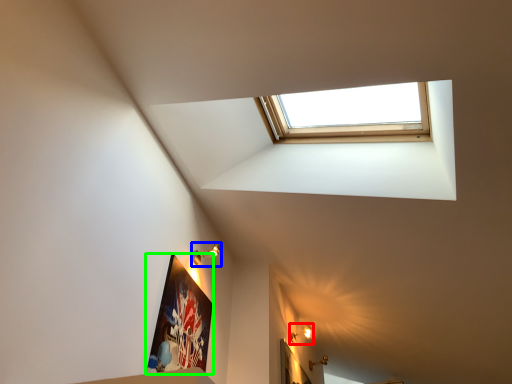
Question: Which object is the farthest from light fixture (highlighted by a red box)? Choose among these: light fixture (highlighted by a blue box) or picture frame (highlighted by a green box).

Choices:
 (A) light fixture
 (B) picture frame

Answer: (B)